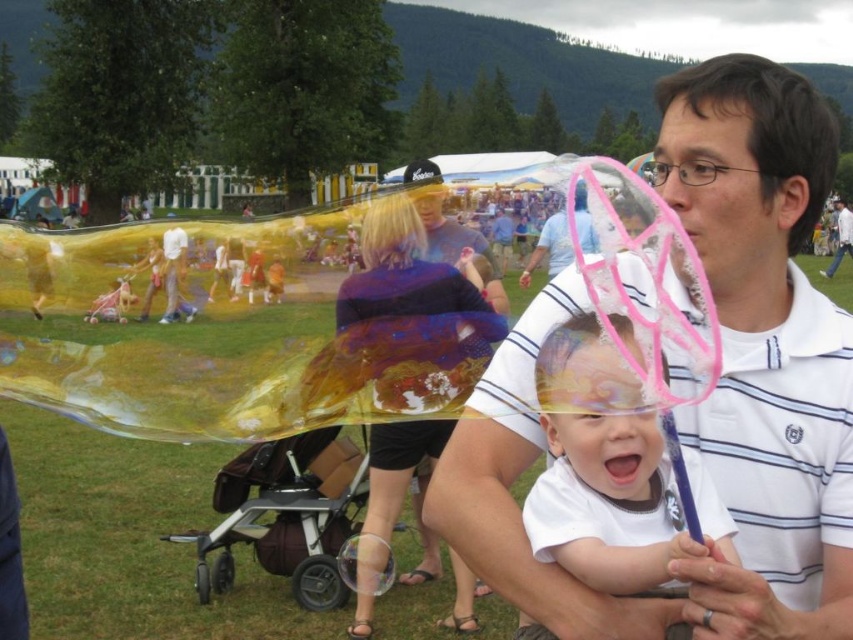
Question: Does brown fabric stroller at lower center come in front of white striped polo shirt at upper right?

Choices:
 (A) no
 (B) yes

Answer: (B)

Question: Which point is closer to the camera taking this photo?

Choices:
 (A) (593, 250)
 (B) (764, 262)
 (C) (282, 557)

Answer: (A)

Question: Estimate the real-world distances between objects in this image. Which object is closer to the white striped shirt at center?

Choices:
 (A) transparent plastic bubble at center
 (B) white striped polo shirt at upper right

Answer: (A)

Question: Is white striped shirt at center wider than matte blue shirt at center?

Choices:
 (A) no
 (B) yes

Answer: (B)

Question: Which of these objects is positioned closest to the white striped polo shirt at upper right?

Choices:
 (A) transparent plastic bubble at center
 (B) white matte baby at center
 (C) matte blue shirt at center
 (D) brown fabric stroller at lower center

Answer: (D)

Question: Does white striped shirt at center appear over white matte baby at center?

Choices:
 (A) yes
 (B) no

Answer: (A)